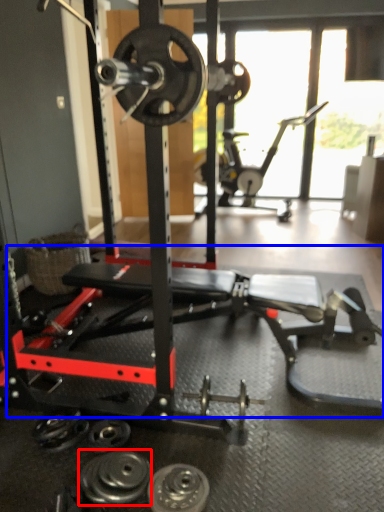
Question: Which of the following is the farthest to the observer, dumbbell (highlighted by a red box) or training bench (highlighted by a blue box)?

Choices:
 (A) dumbbell
 (B) training bench

Answer: (A)